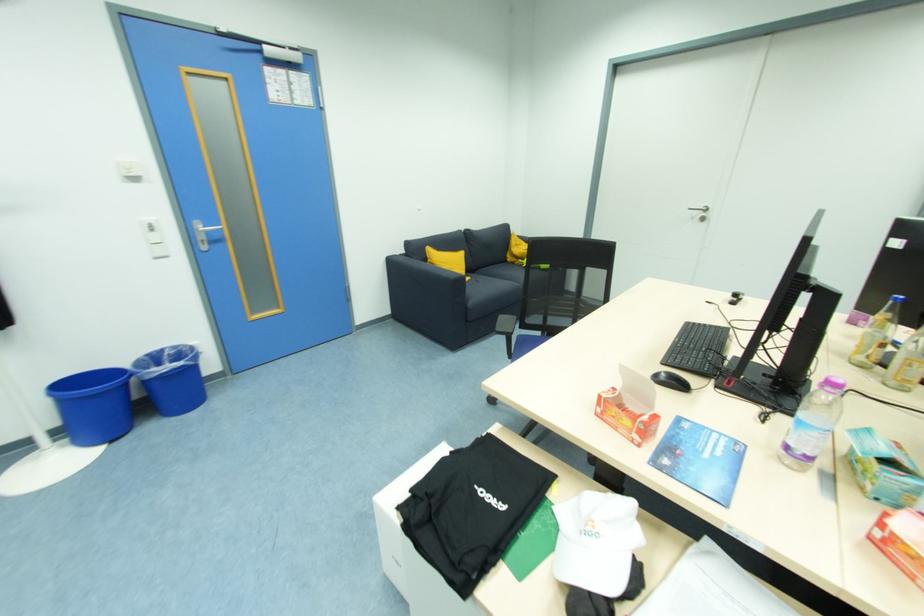
The height and width of the screenshot is (616, 924). I want to click on plastic water bottle, so click(x=812, y=424).